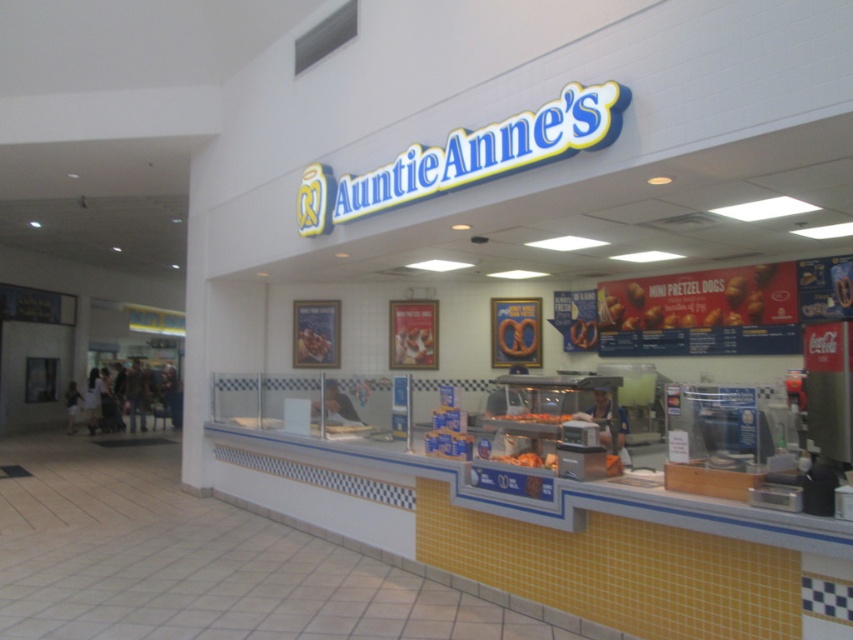
Question: Which point is farther to the camera?

Choices:
 (A) golden crispy pretzel dogs at center
 (B) orange crispy pretzel at center

Answer: (A)

Question: Observing the image, what is the correct spatial positioning of golden crispy pretzel at center in reference to orange crispy pretzel at center?

Choices:
 (A) left
 (B) right

Answer: (A)

Question: Does golden crispy pretzel dogs at center have a larger size compared to golden crispy pretzel at center?

Choices:
 (A) yes
 (B) no

Answer: (A)

Question: Considering the real-world distances, which object is closest to the golden crispy pretzel dogs at center?

Choices:
 (A) orange crispy pretzel at center
 (B) golden crispy pretzel at center

Answer: (A)

Question: Is golden crispy pretzel dogs at center below golden crispy pretzel at center?

Choices:
 (A) yes
 (B) no

Answer: (B)

Question: Which of the following is the farthest from the observer?

Choices:
 (A) golden crispy pretzel dogs at center
 (B) orange crispy pretzel at center
 (C) golden crispy pretzel at center

Answer: (A)